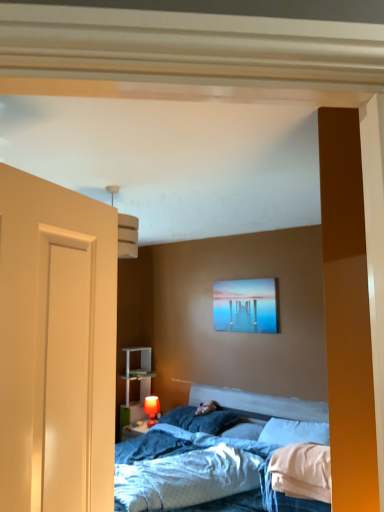
Question: From the image's perspective, is matte red table lamp at lower center beneath white soft pillow at center, the 1th pillow from the right?

Choices:
 (A) no
 (B) yes

Answer: (B)

Question: From a real-world perspective, does matte red table lamp at lower center sit lower than white soft pillow at center, which is counted as the 3th pillow, starting from the left?

Choices:
 (A) no
 (B) yes

Answer: (B)

Question: Is matte red table lamp at lower center oriented towards white soft pillow at center, the 1th pillow from the right?

Choices:
 (A) no
 (B) yes

Answer: (A)

Question: From a real-world perspective, is matte red table lamp at lower center physically above white soft pillow at center, which is counted as the 3th pillow, starting from the left?

Choices:
 (A) no
 (B) yes

Answer: (A)

Question: Does matte red table lamp at lower center have a lesser height compared to white soft pillow at center, the 1th pillow from the right?

Choices:
 (A) yes
 (B) no

Answer: (B)

Question: Is point (215, 285) closer or farther from the camera than point (147, 419)?

Choices:
 (A) closer
 (B) farther

Answer: (A)

Question: Is matte acrylic painting at upper center taller or shorter than matte red table lamp at lower center?

Choices:
 (A) short
 (B) tall

Answer: (B)

Question: Is matte acrylic painting at upper center situated inside matte red table lamp at lower center or outside?

Choices:
 (A) outside
 (B) inside

Answer: (A)

Question: Is matte acrylic painting at upper center to the left or to the right of matte red table lamp at lower center in the image?

Choices:
 (A) left
 (B) right

Answer: (B)

Question: From a real-world perspective, is white soft pillow at center, the 1th pillow from the right, positioned above or below blue textured sheet at center?

Choices:
 (A) above
 (B) below

Answer: (A)

Question: Based on their sizes in the image, would you say white soft pillow at center, which is counted as the 3th pillow, starting from the left, is bigger or smaller than blue textured sheet at center?

Choices:
 (A) big
 (B) small

Answer: (B)

Question: Does point (271, 430) appear closer or farther from the camera than point (167, 437)?

Choices:
 (A) closer
 (B) farther

Answer: (A)

Question: Is white soft pillow at center, which is counted as the 3th pillow, starting from the left, taller or shorter than blue textured sheet at center?

Choices:
 (A) short
 (B) tall

Answer: (B)

Question: Relative to matte acrylic painting at upper center, is white plastic shelf at lower left in front or behind?

Choices:
 (A) front
 (B) behind

Answer: (B)

Question: From a real-world perspective, relative to matte acrylic painting at upper center, is white plastic shelf at lower left vertically above or below?

Choices:
 (A) below
 (B) above

Answer: (A)